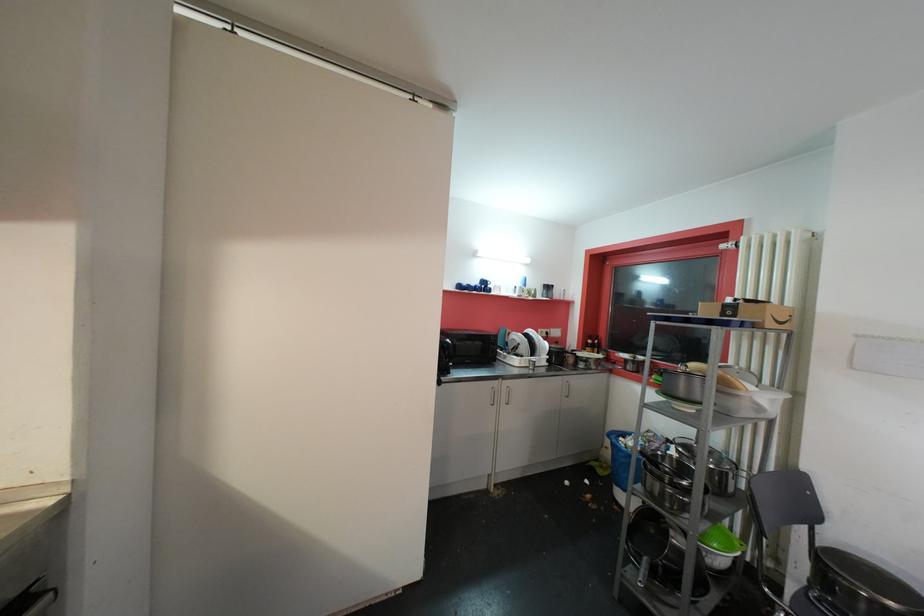
Where would you lift the blue mug? Please return your answer as a coordinate pair (x, y).

(483, 285)